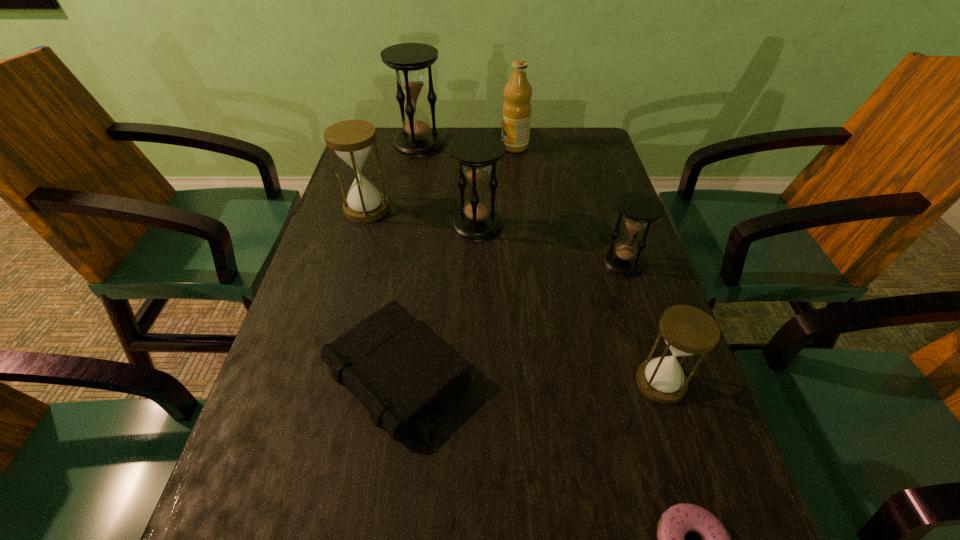
Where is `the farthest hourglass`? the farthest hourglass is located at coordinates (417, 139).

The image size is (960, 540). Find the location of `the biggest black hourglass`. the biggest black hourglass is located at coordinates (417, 139).

This screenshot has height=540, width=960. In order to click on olive oil in this screenshot , I will do `click(516, 114)`.

Identify the location of the second smallest black hourglass. (477, 153).

Locate an element on the screen. This screenshot has width=960, height=540. the third hourglass from right to left is located at coordinates (477, 153).

This screenshot has height=540, width=960. What are the coordinates of `the farther white hourglass` in the screenshot? It's located at point(351,140).

Where is `the left white hourglass`? the left white hourglass is located at coordinates (351, 140).

Find the location of a particular element. Image resolution: width=960 pixels, height=540 pixels. the nearest black hourglass is located at coordinates (639, 209).

Find the location of a particular element. The image size is (960, 540). the fourth farthest hourglass is located at coordinates (639, 209).

You are a GUI agent. You are given a task and a screenshot of the screen. Output one action in this format:
    pyautogui.click(x=<x>, y=<y>)
    Task: Click on the smaller white hourglass
    
    Given the screenshot: What is the action you would take?
    pyautogui.click(x=687, y=330)